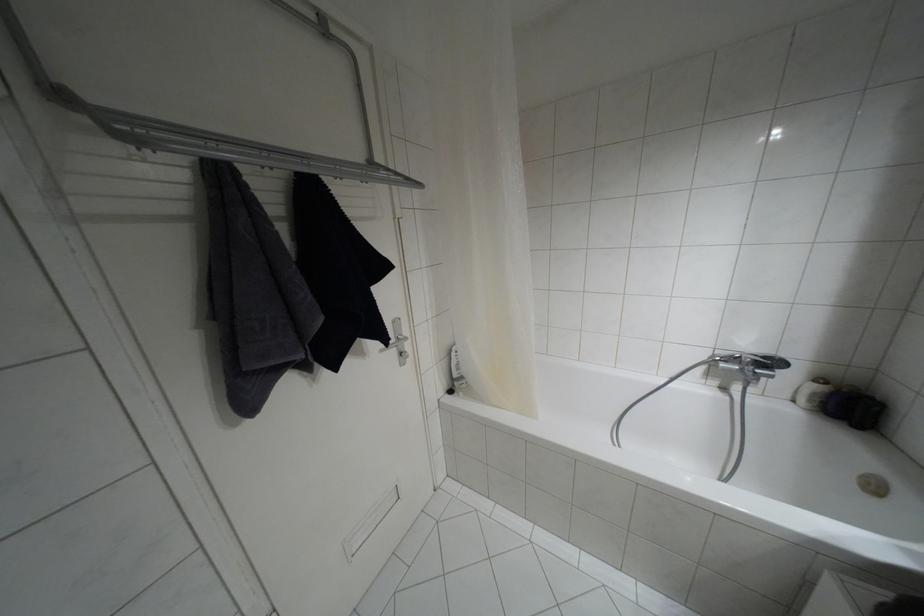
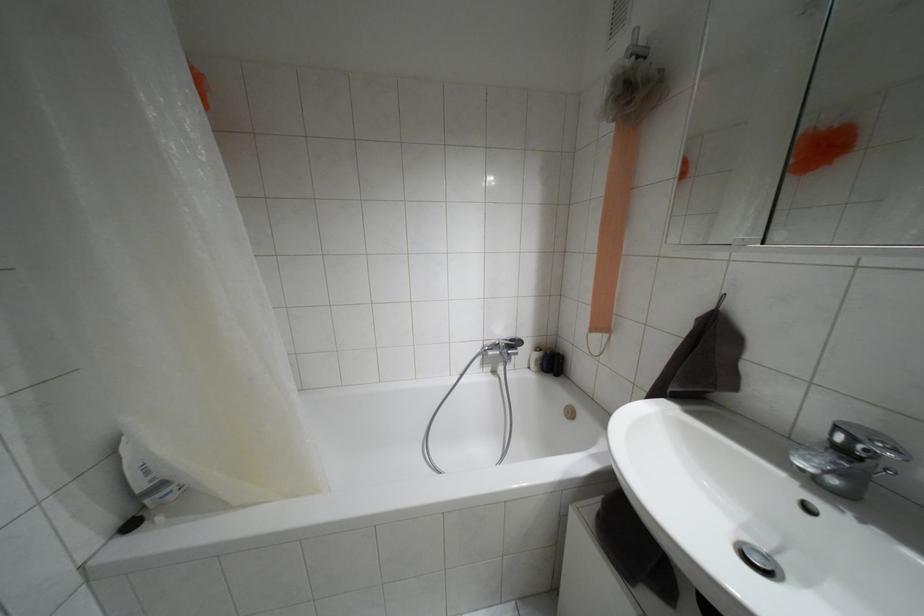
Question: Based on the continuous images, in which direction is the camera rotating? Reply with the corresponding letter.

Choices:
 (A) Left
 (B) Right
 (C) Up
 (D) Down

Answer: (B)